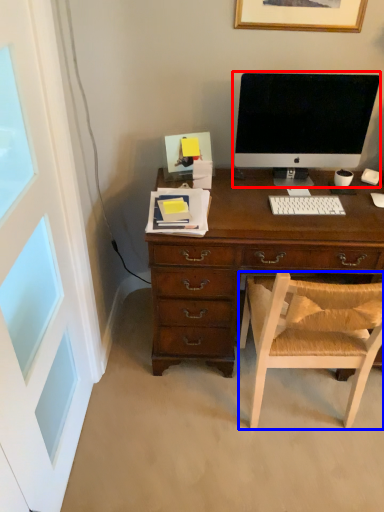
Question: Which object is closer to the camera taking this photo, computer monitor (highlighted by a red box) or chair (highlighted by a blue box)?

Choices:
 (A) computer monitor
 (B) chair

Answer: (B)